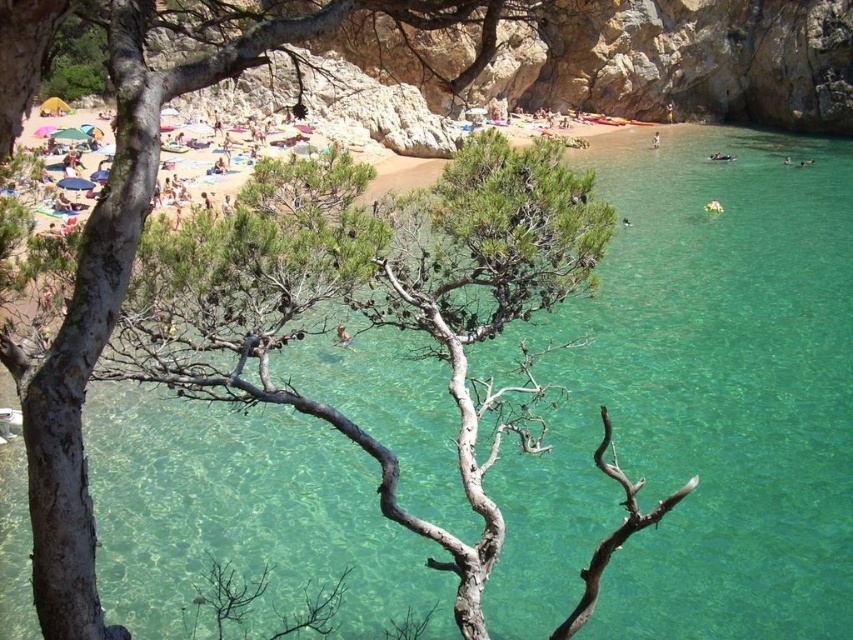
Question: Can you confirm if smooth skin person at center is positioned to the right of white fabric person at lower right?

Choices:
 (A) yes
 (B) no

Answer: (B)

Question: Is smooth skin person at center further to the viewer compared to white fabric person at lower right?

Choices:
 (A) no
 (B) yes

Answer: (A)

Question: Which object is the farthest from the dark blue swimwear at lower right?

Choices:
 (A) white fabric person at lower right
 (B) smooth skin person at center

Answer: (B)

Question: Is dark blue swimwear at lower right to the left of white fabric person at lower right from the viewer's perspective?

Choices:
 (A) no
 (B) yes

Answer: (A)

Question: Which point is farther to the camera?

Choices:
 (A) (654, 138)
 (B) (730, 156)
 (C) (338, 330)

Answer: (A)

Question: Which point is farther from the camera taking this photo?

Choices:
 (A) (340, 337)
 (B) (714, 160)
 (C) (657, 132)

Answer: (C)